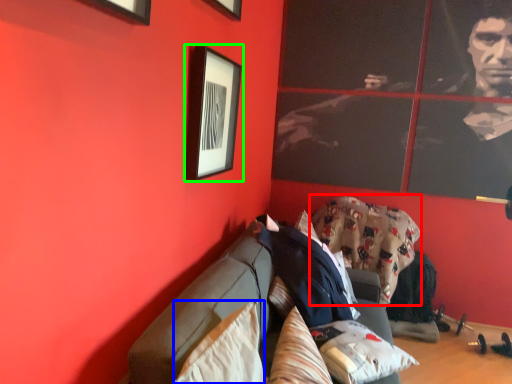
Question: Which object is positioned farthest from blanket (highlighted by a red box)? Select from pillow (highlighted by a blue box) and picture frame (highlighted by a green box).

Choices:
 (A) pillow
 (B) picture frame

Answer: (A)